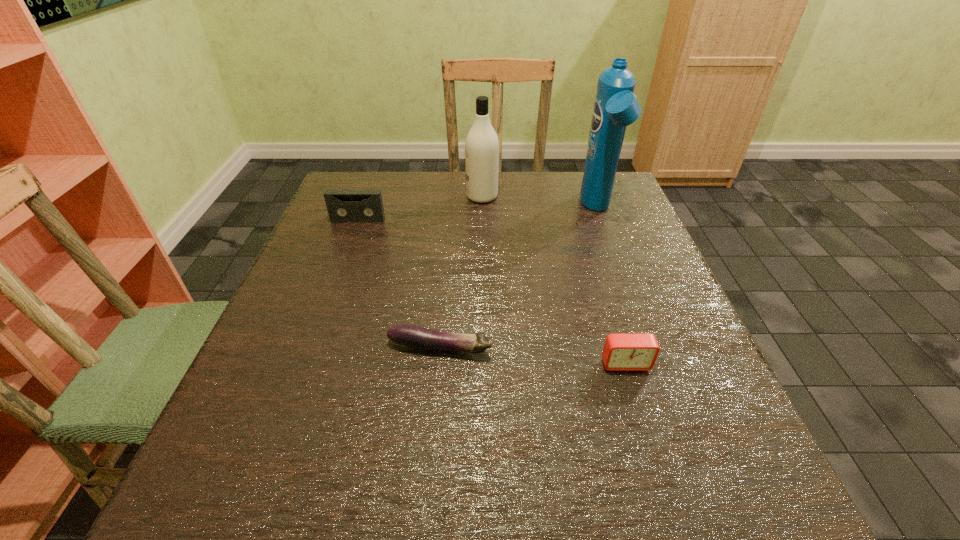
This screenshot has width=960, height=540. What are the coordinates of `vacant area that lies between the videotape and the shorter shampoo` in the screenshot? It's located at (420, 208).

This screenshot has width=960, height=540. In order to click on free space between the videotape and the taller shampoo in this screenshot , I will do `click(478, 215)`.

Where is `free space between the fourth shortest object and the shortest object`? free space between the fourth shortest object and the shortest object is located at coordinates (461, 272).

Find the location of a particular element. The image size is (960, 540). unoccupied area between the shortest object and the taller shampoo is located at coordinates click(518, 279).

What are the coordinates of `free space between the second shortest object and the shorter shampoo` in the screenshot? It's located at (554, 280).

What are the coordinates of `free space that is in between the alarm clock and the third shortest object` in the screenshot? It's located at (492, 292).

Locate which object ranks fourth in proximity to the leftmost object. Please provide its 2D coordinates. Your answer should be formatted as a tuple, i.e. [(x, y)], where the tuple contains the x and y coordinates of a point satisfying the conditions above.

[(622, 352)]

Find the location of a particular element. This screenshot has height=540, width=960. object that ranks as the closest to the fourth shortest object is located at coordinates click(344, 206).

The image size is (960, 540). What are the coordinates of `vacant region that satisfies the following two spatial constraints: 1. on the front-facing side of the second tallest object; 2. on the front-facing side of the videotape` in the screenshot? It's located at (482, 220).

Where is `free spot that satisfies the following two spatial constraints: 1. on the front-facing side of the third tallest object; 2. on the right side of the eggplant`? The image size is (960, 540). free spot that satisfies the following two spatial constraints: 1. on the front-facing side of the third tallest object; 2. on the right side of the eggplant is located at coordinates (311, 348).